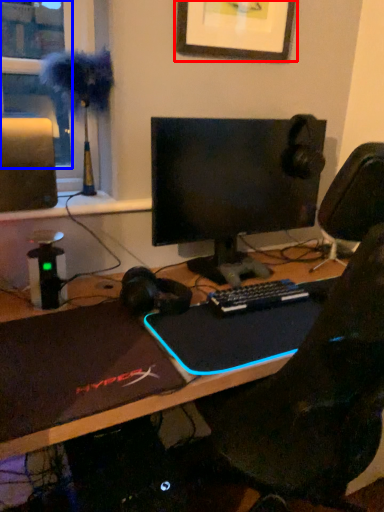
Question: Which of the following is the farthest to the observer, picture frame (highlighted by a red box) or window screen (highlighted by a blue box)?

Choices:
 (A) picture frame
 (B) window screen

Answer: (A)